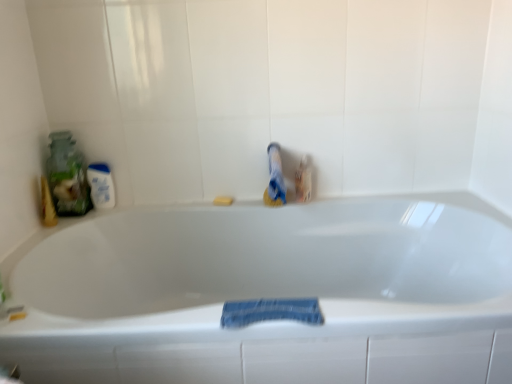
At what (x,y) coordinates should I click in order to perform the action: click on white glossy bathtub at center. Please return your answer as a coordinate pair (x, y). This screenshot has height=384, width=512. Looking at the image, I should click on (268, 293).

Describe the element at coordinates (101, 185) in the screenshot. I see `white glossy mouthwash at left` at that location.

The height and width of the screenshot is (384, 512). Identify the location of yellow sponge at center. (223, 200).

Describe the element at coordinates (270, 311) in the screenshot. I see `faded denim towel at lower center` at that location.

Locate an element on the screen. The image size is (512, 384). white glossy bathtub at center is located at coordinates (268, 293).

How different are the orientations of yellow sponge at center and translucent glass jar at left in degrees?

The angle between the facing direction of yellow sponge at center and the facing direction of translucent glass jar at left is 1.17 degrees.

From a real-world perspective, who is located higher, yellow sponge at center or translucent glass jar at left?

translucent glass jar at left.

Locate an element on the screen. cleaning product in front of the yellow sponge at center is located at coordinates (67, 176).

Is translucent glass jar at left surrounded by yellow sponge at center?

Actually, translucent glass jar at left is outside yellow sponge at center.

Based on the photo, considering the sizes of translucent glass jar at left and faded denim towel at lower center in the image, is translucent glass jar at left bigger or smaller than faded denim towel at lower center?

In the image, translucent glass jar at left appears to be larger than faded denim towel at lower center.

Is the position of translucent glass jar at left less distant than that of faded denim towel at lower center?

No, it is not.

Is translucent glass jar at left next to faded denim towel at lower center and touching it?

No, translucent glass jar at left is not next to faded denim towel at lower center.

Can white glossy mouthwash at left be found inside white glossy bathtub at center?

No, white glossy bathtub at center does not contain white glossy mouthwash at left.

Are white glossy bathtub at center and white glossy mouthwash at left far apart?

No, there isn't a large distance between white glossy bathtub at center and white glossy mouthwash at left.

Locate an element on the screen. The image size is (512, 384). mouthwash above the white glossy bathtub at center (from a real-world perspective) is located at coordinates (101, 185).

Would you say white glossy bathtub at center is to the left or to the right of white glossy mouthwash at left in the picture?

white glossy bathtub at center is positioned on white glossy mouthwash at left's right side.

Where is `mouthwash lying behind the translucent glass jar at left`? mouthwash lying behind the translucent glass jar at left is located at coordinates (101, 185).

Could translucent glass jar at left be considered to be inside white glossy mouthwash at left?

No, translucent glass jar at left is located outside of white glossy mouthwash at left.

Are white glossy mouthwash at left and translucent glass jar at left far apart?

white glossy mouthwash at left is near translucent glass jar at left, not far away.

Can you tell me how much white glossy mouthwash at left and translucent glass jar at left differ in facing direction?

0.00265 degrees.

Is yellow sponge at center aimed at faded denim towel at lower center?

Yes, yellow sponge at center is facing faded denim towel at lower center.

Is yellow sponge at center shorter than faded denim towel at lower center?

No.

Consider the image. Would you say yellow sponge at center is inside or outside faded denim towel at lower center?

yellow sponge at center lies outside faded denim towel at lower center.

Considering the relative sizes of yellow sponge at center and faded denim towel at lower center in the image provided, is yellow sponge at center thinner than faded denim towel at lower center?

Indeed, yellow sponge at center has a lesser width compared to faded denim towel at lower center.

Is white glossy bathtub at center positioned far away from yellow sponge at center?

white glossy bathtub at center is actually quite close to yellow sponge at center.

Find the location of a particular element. Image resolution: width=512 pixels, height=384 pixels. bathtub in front of the yellow sponge at center is located at coordinates (268, 293).

In the scene shown: From the image's perspective, is white glossy bathtub at center over yellow sponge at center?

No, from the image's perspective, white glossy bathtub at center is not on top of yellow sponge at center.

Which object is closer to the camera taking this photo, faded denim towel at lower center or white glossy bathtub at center?

white glossy bathtub at center.

Considering the sizes of objects faded denim towel at lower center and white glossy bathtub at center in the image provided, who is smaller, faded denim towel at lower center or white glossy bathtub at center?

With smaller size is faded denim towel at lower center.

The width and height of the screenshot is (512, 384). What are the coordinates of `cleaning product located above the yellow sponge at center (from the image's perspective)` in the screenshot? It's located at (67, 176).

Locate an element on the screen. The image size is (512, 384). bath towel that appears on the right of translucent glass jar at left is located at coordinates (270, 311).

Which object lies further to the anchor point yellow sponge at center, faded denim towel at lower center or white glossy mouthwash at left?

faded denim towel at lower center is further to yellow sponge at center.

Looking at the image, which one is located further to faded denim towel at lower center, yellow sponge at center or translucent glass jar at left?

The object further to faded denim towel at lower center is translucent glass jar at left.

Estimate the real-world distances between objects in this image. Which object is further from yellow sponge at center, white glossy bathtub at center or translucent glass jar at left?

white glossy bathtub at center is further to yellow sponge at center.

Considering their positions, is faded denim towel at lower center positioned further to white glossy bathtub at center than translucent glass jar at left?

→ translucent glass jar at left.

Estimate the real-world distances between objects in this image. Which object is closer to faded denim towel at lower center, white glossy bathtub at center or translucent glass jar at left?

white glossy bathtub at center lies closer to faded denim towel at lower center than the other object.

From the image, which object appears to be nearer to white glossy mouthwash at left, faded denim towel at lower center or translucent glass jar at left?

translucent glass jar at left.

Which object lies further to the anchor point translucent glass jar at left, yellow sponge at center or white glossy bathtub at center?

The object further to translucent glass jar at left is white glossy bathtub at center.

When comparing their distances from white glossy mouthwash at left, does yellow sponge at center or white glossy bathtub at center seem closer?

yellow sponge at center lies closer to white glossy mouthwash at left than the other object.

Find the location of a particular element. This screenshot has height=384, width=512. bath towel located between white glossy bathtub at center and white glossy mouthwash at left in the depth direction is located at coordinates (270, 311).

Identify the location of mouthwash located between faded denim towel at lower center and yellow sponge at center in the depth direction. The image size is (512, 384). (101, 185).

The height and width of the screenshot is (384, 512). In order to click on mouthwash situated between translucent glass jar at left and faded denim towel at lower center from left to right in this screenshot , I will do `click(101, 185)`.

The image size is (512, 384). Find the location of `soap situated between translucent glass jar at left and faded denim towel at lower center from left to right`. soap situated between translucent glass jar at left and faded denim towel at lower center from left to right is located at coordinates (223, 200).